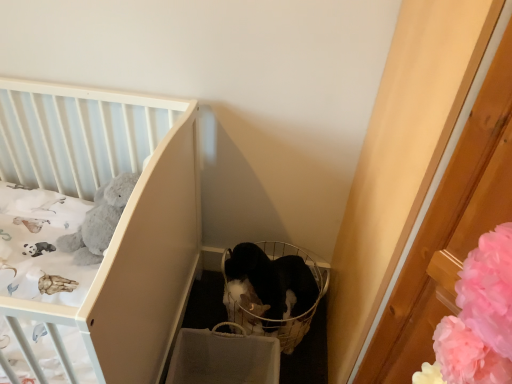
In order to face black fur cat at center, should I rotate leftwards or rightwards?

Rotate right and turn 2.049 degrees.

The width and height of the screenshot is (512, 384). What are the coordinates of `black fur cat at center` in the screenshot? It's located at (274, 279).

Between black fabric basket at center and white matte crib at upper left, which one is positioned in front?

white matte crib at upper left.

Consider the image. Considering the sizes of objects black fabric basket at center and white matte crib at upper left in the image provided, who is thinner, black fabric basket at center or white matte crib at upper left?

With smaller width is black fabric basket at center.

From a real-world perspective, is white matte crib at upper left physically below black fur cat at center?

No, from a real-world perspective, white matte crib at upper left is not below black fur cat at center.

Consider the image. Who is shorter, white matte crib at upper left or black fur cat at center?

black fur cat at center is shorter.

I want to click on cat on the right of the white matte crib at upper left, so click(274, 279).

Who is smaller, white matte crib at upper left or black fur cat at center?

With smaller size is black fur cat at center.

Which object is wider, black fur cat at center or black fabric basket at center?

With larger width is black fur cat at center.

Does black fur cat at center have a lesser height compared to black fabric basket at center?

Yes.

Is black fur cat at center situated inside black fabric basket at center or outside?

black fur cat at center fits inside black fabric basket at center.

Is black fur cat at center not near black fabric basket at center?

No, there isn't a large distance between black fur cat at center and black fabric basket at center.

Which object is positioned more to the left, black fabric basket at center or black fur cat at center?

black fur cat at center.

Would you consider black fabric basket at center to be distant from black fur cat at center?

Actually, black fabric basket at center and black fur cat at center are a little close together.

Is black fabric basket at center facing away from black fur cat at center?

Yes, black fabric basket at center is positioned with its back facing black fur cat at center.

How far apart are black fabric basket at center and black fur cat at center?

A distance of 6.09 inches exists between black fabric basket at center and black fur cat at center.

Is black fur cat at center oriented away from white matte crib at upper left?

No, white matte crib at upper left is not at the back of black fur cat at center.

Looking at this image, considering the relative sizes of black fur cat at center and white matte crib at upper left in the image provided, is black fur cat at center taller than white matte crib at upper left?

No.

Who is smaller, black fur cat at center or white matte crib at upper left?

black fur cat at center is smaller.

From a real-world perspective, who is located lower, white matte crib at upper left or black fabric basket at center?

black fabric basket at center, from a real-world perspective.

Locate an element on the screen. baby carriage behind the white matte crib at upper left is located at coordinates (255, 356).

From the image's perspective, does white matte crib at upper left appear lower than black fabric basket at center?

Actually, white matte crib at upper left appears above black fabric basket at center in the image.

Is white matte crib at upper left positioned with its back to black fabric basket at center?

No, white matte crib at upper left is not facing the opposite direction of black fabric basket at center.

You are a GUI agent. You are given a task and a screenshot of the screen. Output one action in this format:
    pyautogui.click(x=<x>, y=<y>)
    Task: Click on the infant bed that appears in front of the black fabric basket at center
    The width and height of the screenshot is (512, 384).
    Given the screenshot: What is the action you would take?
    click(121, 216)

Identify the location of cat below the white matte crib at upper left (from the image's perspective). The width and height of the screenshot is (512, 384). (274, 279).

From the image, which object appears to be farther from black fur cat at center, black fabric basket at center or white matte crib at upper left?

white matte crib at upper left.

Estimate the real-world distances between objects in this image. Which object is closer to black fur cat at center, white matte crib at upper left or black fabric basket at center?

black fabric basket at center is closer to black fur cat at center.

When comparing their distances from white matte crib at upper left, does black fabric basket at center or black fur cat at center seem closer?

black fabric basket at center is positioned closer to the anchor white matte crib at upper left.

Looking at the image, which one is located further to black fabric basket at center, black fur cat at center or white matte crib at upper left?

white matte crib at upper left is further to black fabric basket at center.

Which object lies further to the anchor point black fabric basket at center, white matte crib at upper left or black fur cat at center?

Among the two, white matte crib at upper left is located further to black fabric basket at center.

From the image, which object appears to be nearer to white matte crib at upper left, black fur cat at center or black fabric basket at center?

black fabric basket at center is closer to white matte crib at upper left.

Find the location of a particular element. The image size is (512, 384). cat located between white matte crib at upper left and black fabric basket at center in the left-right direction is located at coordinates (274, 279).